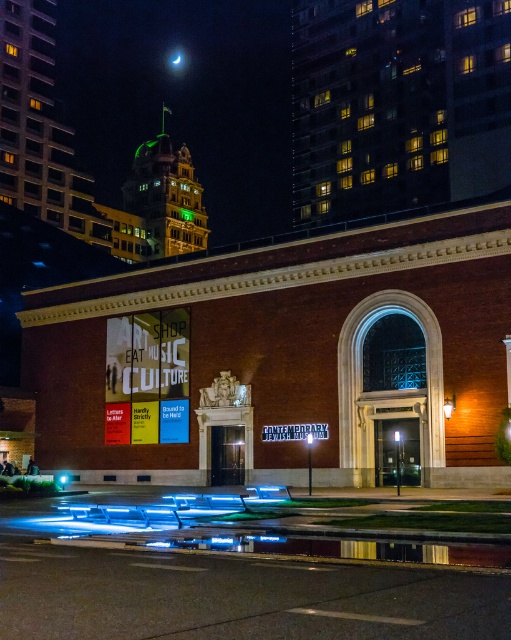
Question: Is matte glass sign at center behind brick building at upper right?

Choices:
 (A) yes
 (B) no

Answer: (B)

Question: Is matte glass sign at center wider than brick building at upper right?

Choices:
 (A) yes
 (B) no

Answer: (A)

Question: Which object is farther from the camera taking this photo?

Choices:
 (A) brick building at upper right
 (B) matte glass sign at center

Answer: (A)

Question: Does matte glass sign at center appear over brick building at upper right?

Choices:
 (A) yes
 (B) no

Answer: (B)